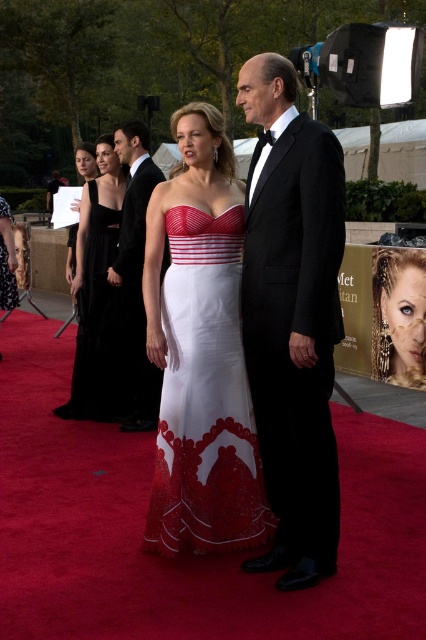
Question: Which point is farther from the camera taking this photo?

Choices:
 (A) tap(89, 216)
 (B) tap(233, 428)
 (C) tap(9, 289)
 (D) tap(138, 396)

Answer: (C)

Question: Which point appears closest to the camera in this image?

Choices:
 (A) (6, 227)
 (B) (379, 310)
 (C) (270, 243)
 (D) (137, 428)

Answer: (C)

Question: Does black satin tuxedo at center appear on the left side of white satin dress at center?

Choices:
 (A) yes
 (B) no

Answer: (B)

Question: Can you confirm if black satin tuxedo at center is smaller than black velvet dress at left?

Choices:
 (A) yes
 (B) no

Answer: (A)

Question: Which object appears closest to the camera in this image?

Choices:
 (A) matte white gown at center
 (B) white lace dress at center
 (C) shiny gold earrings at center

Answer: (A)

Question: Considering the relative positions of black satin tuxedo at center and shiny gold earrings at center in the image provided, where is black satin tuxedo at center located with respect to shiny gold earrings at center?

Choices:
 (A) below
 (B) above

Answer: (B)